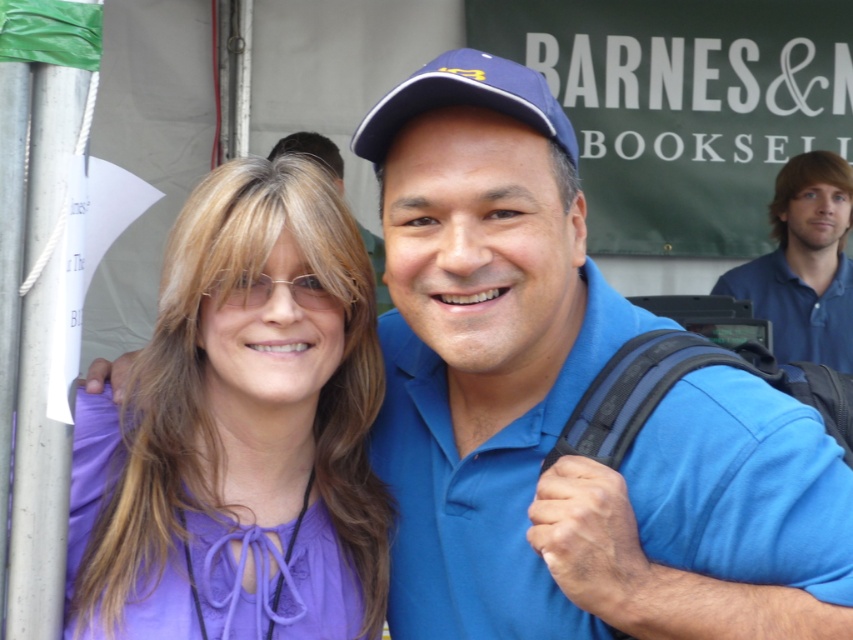
You are a photographer adjusting the camera settings for a portrait. The subjects are wearing the purple silky blouse at center and the blue fabric baseball cap at center. To ensure both are in focus, which subject should you prioritize focusing on first based on their vertical positions?

The purple silky blouse at center has a greater height compared to the blue fabric baseball cap at center, so you should focus on the purple silky blouse at center first to ensure both are in focus.

You are a photographer adjusting the camera settings to ensure both the purple silky blouse at center and the blue fabric baseball cap at center are in focus. Which object should you adjust the focus to prioritize first to ensure both are clear?

The purple silky blouse at center is larger in size than the blue fabric baseball cap at center, so you should prioritize focusing on the purple silky blouse at center first to ensure both are clear.

You are a photographer trying to focus on the blue cotton shirt at upper right and the blue fabric baseball cap at center. Which object should you zoom in on first if you want to capture both in the same frame without moving the camera?

You should zoom in on the blue cotton shirt at upper right first because it is larger in size than the blue fabric baseball cap at center, so adjusting focus on the larger object first will ensure both fit within the frame.